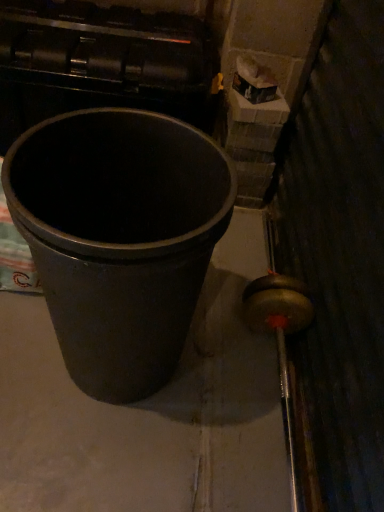
Based on the photo, in order to face matte black trash can at center-left, should I rotate leftwards or rightwards?

Rotate left and turn 8.841 degrees.

You are a GUI agent. You are given a task and a screenshot of the screen. Output one action in this format:
    pyautogui.click(x=<x>, y=<y>)
    Task: Click on the matte black trash can at center-left
    Image resolution: width=384 pixels, height=512 pixels.
    Given the screenshot: What is the action you would take?
    pyautogui.click(x=119, y=238)

What is the approximate width of matte black trash can at center-left?

It is 14.82 inches.

The image size is (384, 512). Describe the element at coordinates (119, 238) in the screenshot. I see `matte black trash can at center-left` at that location.

You are a GUI agent. You are given a task and a screenshot of the screen. Output one action in this format:
    pyautogui.click(x=<x>, y=<y>)
    Task: Click on the matte black trash can at center-left
    The image size is (384, 512).
    Given the screenshot: What is the action you would take?
    pyautogui.click(x=119, y=238)